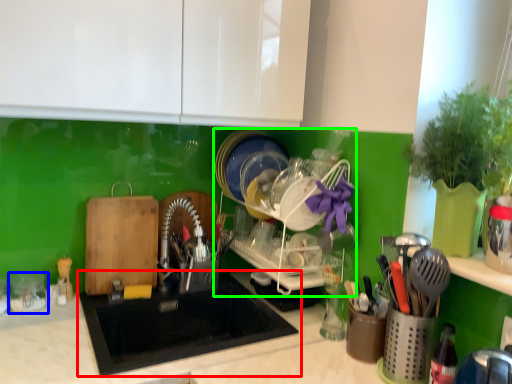
Question: Considering the real-world distances, which object is farthest from sink (highlighted by a red box)? tableware (highlighted by a blue box) or dish washer (highlighted by a green box)?

Choices:
 (A) tableware
 (B) dish washer

Answer: (A)